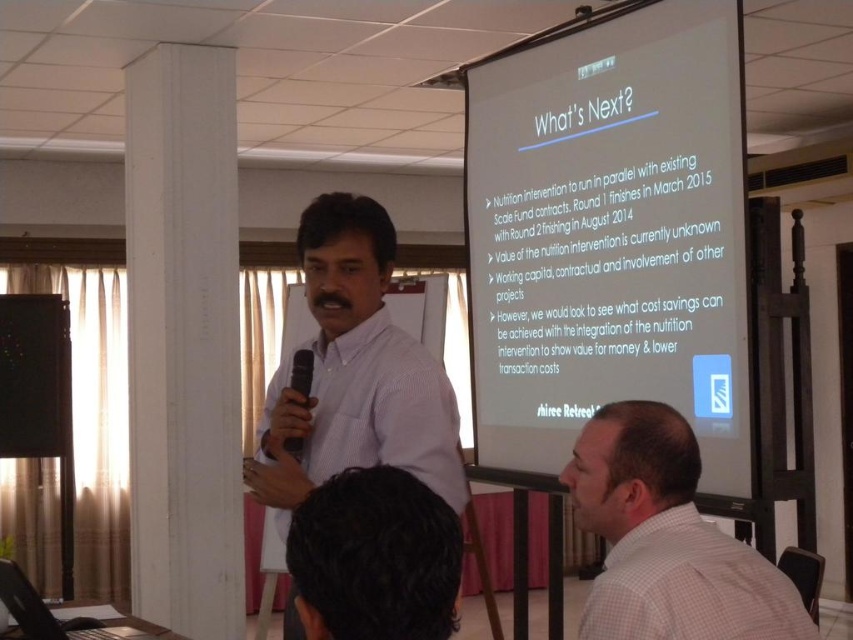
You are an attendee at the presentation. You notice the white checkered shirt at lower right and the dark brown hair at upper center. Which object is positioned lower in the image?

The white checkered shirt at lower right is positioned below the dark brown hair at upper center, so the white checkered shirt at lower right is lower in the image.

You are an attendee at the presentation and want to point out something on the screen. You notice two points on the screen. Which point is closer to you, point [730,605] or point [392,518]?

Point [392,518] is closer to you because it is less further to the viewer than point [730,605].

You are standing in the presentation room and want to move to the point at coordinates (772, 636). If you are 5 feet tall, will you be able to see the projection screen displaying the slide titled

The point at coordinates (772, 636) is 4.28 feet away from you. Since the projection screen is located to the right of the presenter and you are moving towards the point, you should be able to see the screen as long as there are no obstructions between you and the screen.